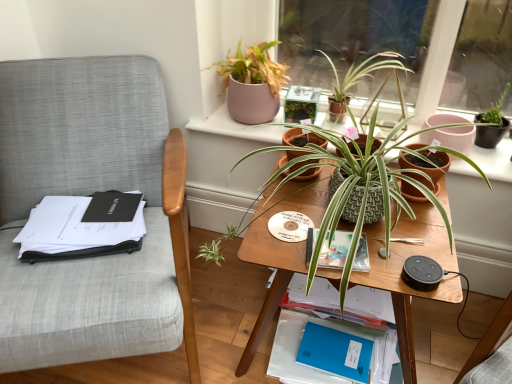
Image resolution: width=512 pixels, height=384 pixels. I want to click on free space above blue matte paperback book at lower center, the first paperback book from the bottom (from a real-world perspective), so [339, 341].